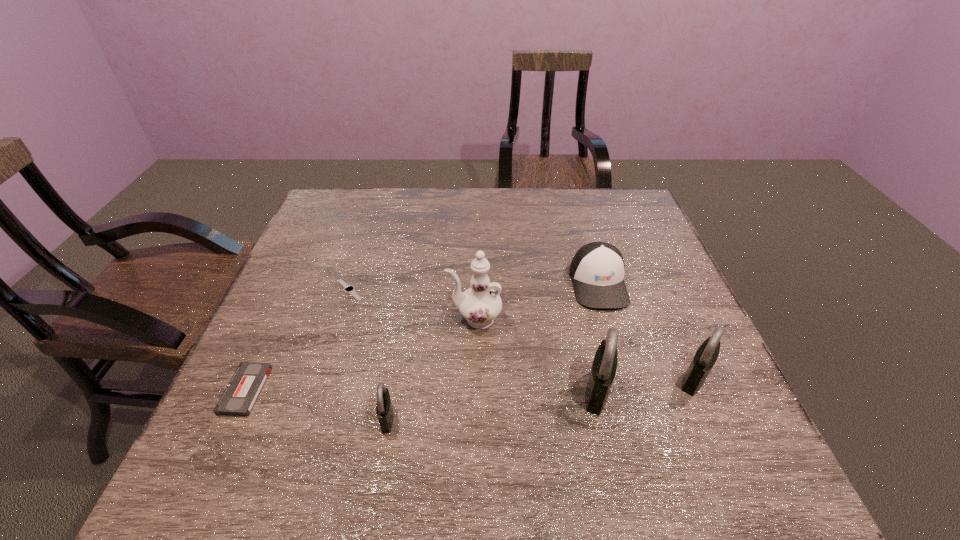
Find the location of `blank space located 0.140m on the back of the videotape`. blank space located 0.140m on the back of the videotape is located at coordinates (278, 319).

I want to click on videotape at the near edge, so click(x=239, y=397).

This screenshot has height=540, width=960. I want to click on watch located at the left edge, so click(x=349, y=289).

The image size is (960, 540). I want to click on videotape present at the left edge, so click(239, 397).

Where is `padlock that is at the right edge`? This screenshot has width=960, height=540. padlock that is at the right edge is located at coordinates (706, 355).

Locate an element on the screen. cap located in the right edge section of the desktop is located at coordinates (597, 270).

Identify the location of object located at the near left corner. The width and height of the screenshot is (960, 540). (239, 397).

Find the location of `object that is at the near right corner`. object that is at the near right corner is located at coordinates (x=706, y=355).

Find the location of `vacant space at the far edge of the desktop`. vacant space at the far edge of the desktop is located at coordinates (395, 191).

Where is `free space at the near edge`? free space at the near edge is located at coordinates (394, 428).